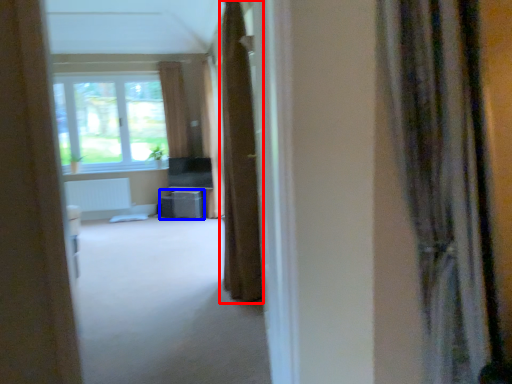
Question: Which object appears farthest to the camera in this image, curtain (highlighted by a red box) or furniture (highlighted by a blue box)?

Choices:
 (A) curtain
 (B) furniture

Answer: (B)